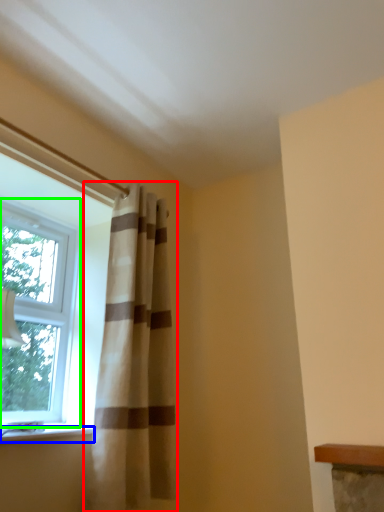
Question: Which object is positioned closest to curtain (highlighted by a red box)? Select from window sill (highlighted by a blue box) and window (highlighted by a green box).

Choices:
 (A) window sill
 (B) window

Answer: (A)